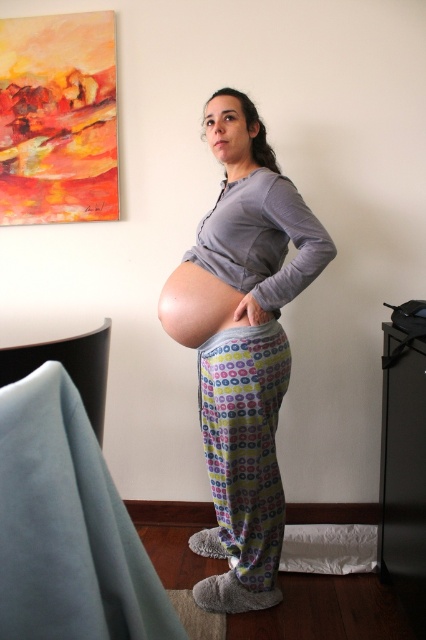
Is point (282, 330) behind point (255, 445)?

Yes, it is behind point (255, 445).

Does matte gray sweatshirt at center come in front of printed cotton leggings at center?

Yes, it is.

This screenshot has width=426, height=640. Identify the location of matte gray sweatshirt at center. (244, 348).

Is printed cotton leggings at center shorter than matte skin at center?

No, printed cotton leggings at center is not shorter than matte skin at center.

Does printed cotton leggings at center have a greater height compared to matte skin at center?

Yes.

At what (x,y) coordinates should I click in order to perform the action: click on printed cotton leggings at center. Please return your answer as a coordinate pair (x, y). The image size is (426, 640). Looking at the image, I should click on (244, 445).

Between matte gray sweatshirt at center and matte skin at center, which one is positioned higher?

Positioned higher is matte skin at center.

Does matte gray sweatshirt at center have a greater width compared to matte skin at center?

Yes, matte gray sweatshirt at center is wider than matte skin at center.

Does point (259, 586) come behind point (196, 337)?

Yes, it is.

The image size is (426, 640). I want to click on matte gray sweatshirt at center, so click(244, 348).